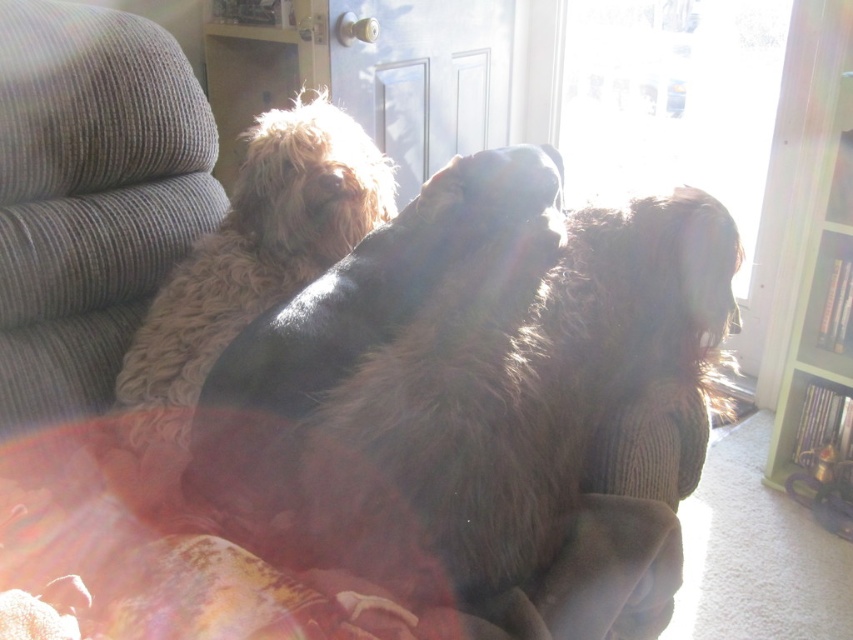
Question: Which of these objects is positioned closest to the fuzzy brown dog at center?

Choices:
 (A) fluffy beige dog at upper left
 (B) fluffy multicolored blanket at center
 (C) green painted wood bookshelf at right

Answer: (B)

Question: Is the position of fuzzy brown dog at center less distant than that of green painted wood bookshelf at right?

Choices:
 (A) yes
 (B) no

Answer: (A)

Question: Which is farther from the fluffy multicolored blanket at center?

Choices:
 (A) fluffy beige dog at upper left
 (B) fuzzy brown dog at center

Answer: (A)

Question: Which point is closer to the camera?

Choices:
 (A) fluffy multicolored blanket at center
 (B) fluffy beige dog at upper left
 (C) fuzzy brown dog at center
 (D) green painted wood bookshelf at right

Answer: (A)

Question: Where is fuzzy brown dog at center located in relation to fluffy beige dog at upper left in the image?

Choices:
 (A) below
 (B) above

Answer: (A)

Question: Can you confirm if fuzzy brown dog at center is positioned below fluffy beige dog at upper left?

Choices:
 (A) yes
 (B) no

Answer: (A)